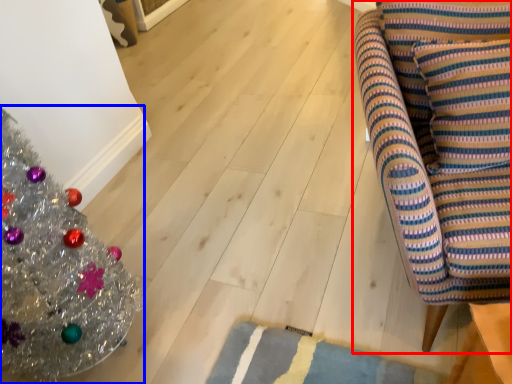
Question: Which of the following is the closest to the observer, furniture (highlighted by a red box) or christmas tree (highlighted by a blue box)?

Choices:
 (A) furniture
 (B) christmas tree

Answer: (B)